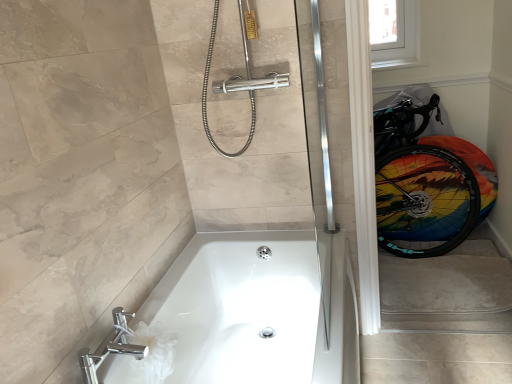
Identify the location of free region under chrome/metallic faucet at lower left (from a real-world perspective). This screenshot has width=512, height=384. (121, 372).